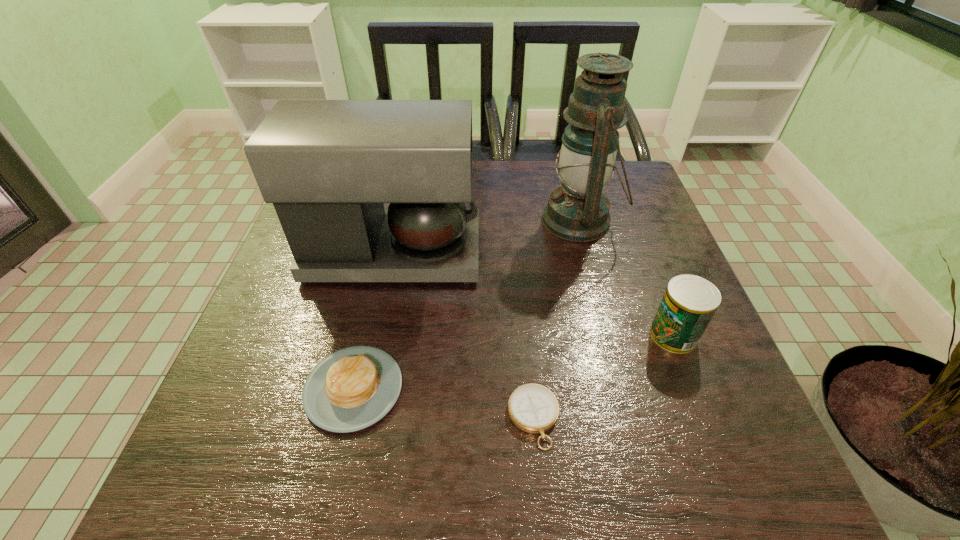
Identify the location of vacant region between the third object from right to left and the third tallest object. (604, 376).

Locate an element on the screen. free space that is in between the tallest object and the shortest object is located at coordinates (x=557, y=319).

Select which object appears as the fourth closest to the second tallest object. Please provide its 2D coordinates. Your answer should be formatted as a tuple, i.e. [(x, y)], where the tuple contains the x and y coordinates of a point satisfying the conditions above.

[(689, 302)]

Find the location of `object that is the fourth nearest to the third object from left to right`. object that is the fourth nearest to the third object from left to right is located at coordinates (578, 211).

This screenshot has width=960, height=540. What are the coordinates of `free point that satisfies the following two spatial constraints: 1. on the back side of the tallest object; 2. on the left side of the third object from left to right` in the screenshot? It's located at (516, 220).

Locate an element on the screen. This screenshot has height=540, width=960. free space in the image that satisfies the following two spatial constraints: 1. on the back side of the can; 2. on the right side of the fourth tallest object is located at coordinates (366, 335).

At what (x,y) coordinates should I click in order to perform the action: click on free spot that satisfies the following two spatial constraints: 1. on the carafe side of the can; 2. on the left side of the coffee maker. Please return your answer as a coordinate pair (x, y). The height and width of the screenshot is (540, 960). Looking at the image, I should click on (376, 335).

This screenshot has width=960, height=540. I want to click on free space in the image that satisfies the following two spatial constraints: 1. on the back side of the tallest object; 2. on the left side of the shortest object, so click(x=516, y=220).

Find the location of a particular element. This screenshot has width=960, height=540. free space in the image that satisfies the following two spatial constraints: 1. on the carafe side of the fourth shortest object; 2. on the right side of the third object from right to left is located at coordinates (359, 418).

Identify the location of free space that satisfies the following two spatial constraints: 1. on the front side of the tallest object; 2. on the right side of the third tallest object. (610, 335).